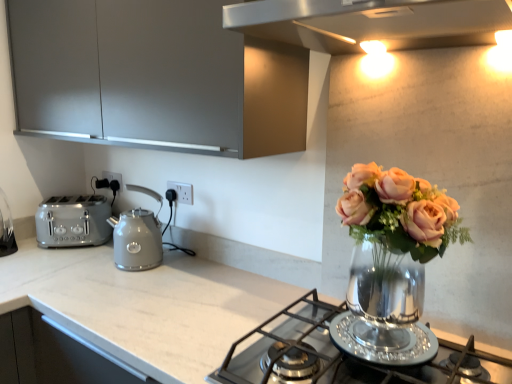
Question: Does matte gray cabinet at upper left turn towards white plastic electric outlet at center, the 2th electric outlet from the right?

Choices:
 (A) yes
 (B) no

Answer: (B)

Question: Does matte gray cabinet at upper left have a larger size compared to white plastic electric outlet at center, which is the second electric outlet from front to back?

Choices:
 (A) no
 (B) yes

Answer: (B)

Question: Is matte gray cabinet at upper left at the right side of white plastic electric outlet at center, which is the second electric outlet from front to back?

Choices:
 (A) yes
 (B) no

Answer: (A)

Question: Is matte gray cabinet at upper left at the left side of white plastic electric outlet at center, which is the second electric outlet from front to back?

Choices:
 (A) yes
 (B) no

Answer: (B)

Question: Considering the relative sizes of matte gray cabinet at upper left and white plastic electric outlet at center, the first electric outlet positioned from the back, in the image provided, is matte gray cabinet at upper left wider than white plastic electric outlet at center, the first electric outlet positioned from the back,?

Choices:
 (A) no
 (B) yes

Answer: (B)

Question: Considering the positions of satin silver toaster at left and polished stainless steel gas stove at center in the image, is satin silver toaster at left wider or thinner than polished stainless steel gas stove at center?

Choices:
 (A) thin
 (B) wide

Answer: (A)

Question: Is satin silver toaster at left bigger or smaller than polished stainless steel gas stove at center?

Choices:
 (A) big
 (B) small

Answer: (B)

Question: Is satin silver toaster at left to the left or to the right of polished stainless steel gas stove at center in the image?

Choices:
 (A) left
 (B) right

Answer: (A)

Question: Is satin silver toaster at left taller or shorter than polished stainless steel gas stove at center?

Choices:
 (A) short
 (B) tall

Answer: (B)

Question: From the image's perspective, relative to matte gray kettle at center, is white plastic electric outlet at center, which is the second electric outlet from front to back, above or below?

Choices:
 (A) below
 (B) above

Answer: (B)

Question: Does point (110, 178) appear closer or farther from the camera than point (128, 261)?

Choices:
 (A) farther
 (B) closer

Answer: (A)

Question: From their relative heights in the image, would you say white plastic electric outlet at center, the 2th electric outlet from the right, is taller or shorter than matte gray kettle at center?

Choices:
 (A) tall
 (B) short

Answer: (B)

Question: In terms of size, does white plastic electric outlet at center, the first electric outlet positioned from the back, appear bigger or smaller than matte gray kettle at center?

Choices:
 (A) big
 (B) small

Answer: (B)

Question: Considering the positions of point (76, 236) and point (53, 311), is point (76, 236) closer or farther from the camera than point (53, 311)?

Choices:
 (A) closer
 (B) farther

Answer: (B)

Question: From a real-world perspective, is satin silver toaster at left positioned above or below white glossy countertop at center?

Choices:
 (A) below
 (B) above

Answer: (B)